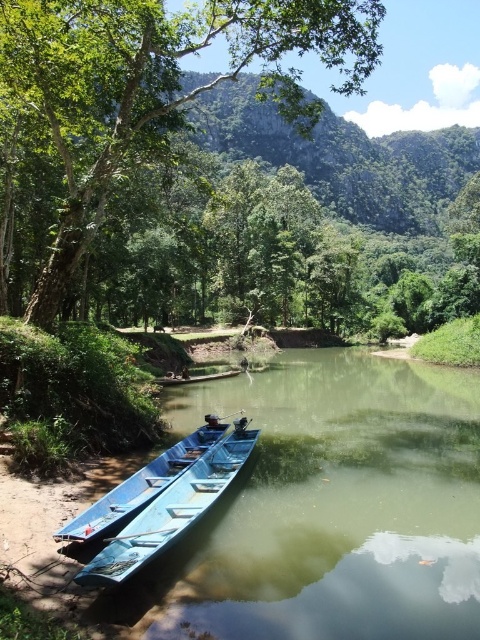
Consider the image. You are standing at the riverbank and want to walk from point A to point B. Point A is at point (70, 268) and point B is at point (182, 474). Which point is closer to you when you start walking?

Point A at point (70, 268) is closer to you because it is further to the viewer than point B at point (182, 474), meaning you can reach it sooner.

Based on the photo, you are standing at the riverbank and want to locate the green leafy tree at center. What are its coordinates?

The green leafy tree at center is located at coordinates point (x=155, y=84).